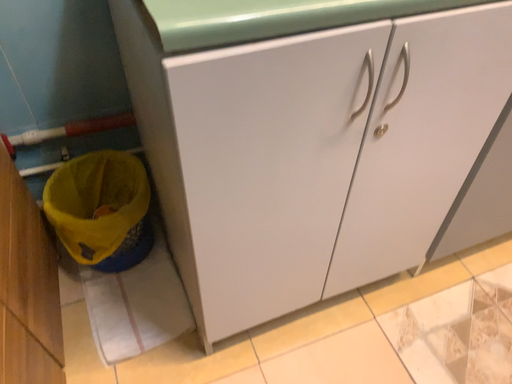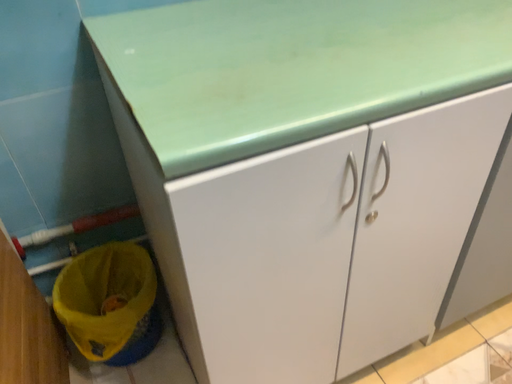
Question: How did the camera likely rotate when shooting the video?

Choices:
 (A) rotated downward
 (B) rotated upward

Answer: (B)